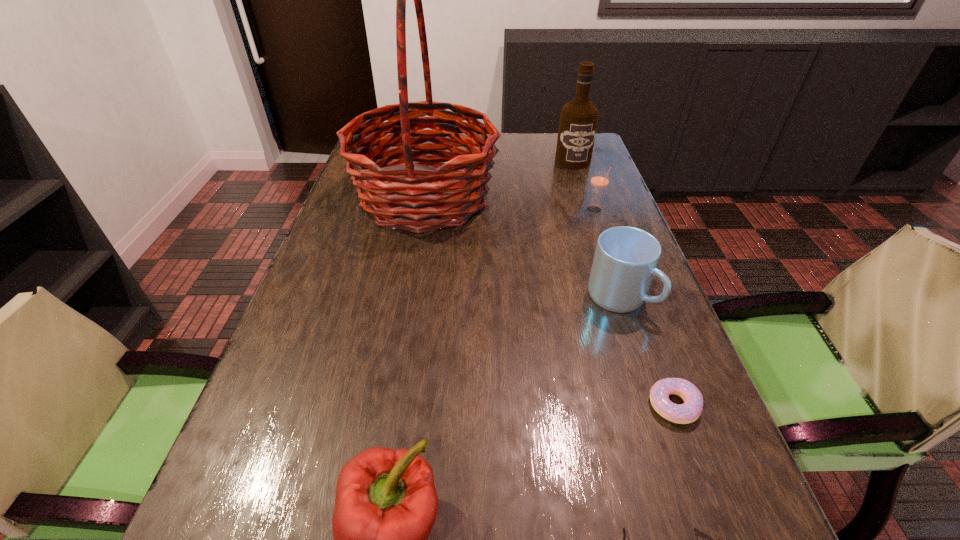
In order to click on the tallest object in this screenshot , I will do `click(456, 187)`.

What are the coordinates of `alcohol` in the screenshot? It's located at (578, 122).

Locate an element on the screen. straw is located at coordinates (599, 181).

Where is `the fourth nearest object`? Image resolution: width=960 pixels, height=540 pixels. the fourth nearest object is located at coordinates (625, 261).

Find the location of a particular element. This screenshot has height=540, width=960. the fifth farthest object is located at coordinates (688, 412).

Find the location of a particular element. This screenshot has width=960, height=540. vacant space located on the handle side of the basket is located at coordinates (608, 198).

Where is `free space located 0.240m on the label of the alcohol`? This screenshot has width=960, height=540. free space located 0.240m on the label of the alcohol is located at coordinates (589, 211).

Where is `vacant space situated 0.220m on the left of the straw`? vacant space situated 0.220m on the left of the straw is located at coordinates (508, 210).

Locate an element on the screen. This screenshot has width=960, height=540. vacant space located on the front of the fourth nearest object is located at coordinates (641, 364).

You are a GUI agent. You are given a task and a screenshot of the screen. Output one action in this format:
    pyautogui.click(x=<x>, y=<y>)
    Task: Click on the vacant area situated on the front of the third nearest object
    The width and height of the screenshot is (960, 540).
    Given the screenshot: What is the action you would take?
    pyautogui.click(x=712, y=508)